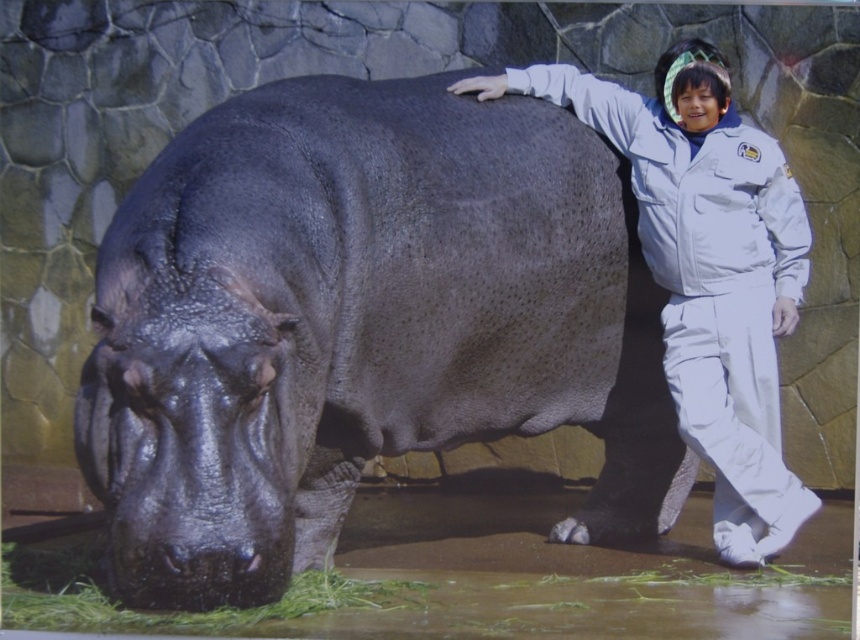
You are a visitor at the zoo and want to take a photo of the shiny dark gray hippo at center and the white matte uniform at right. Where should you position yourself to ensure both are in the frame?

To capture both the shiny dark gray hippo at center and the white matte uniform at right in your photo, position yourself above them since the hippo is located below the uniform.

Based on the scene description, where is the shiny dark gray hippo at center located in terms of its 2D coordinates?

The shiny dark gray hippo at center is located at the 2D coordinates of point (360,324).